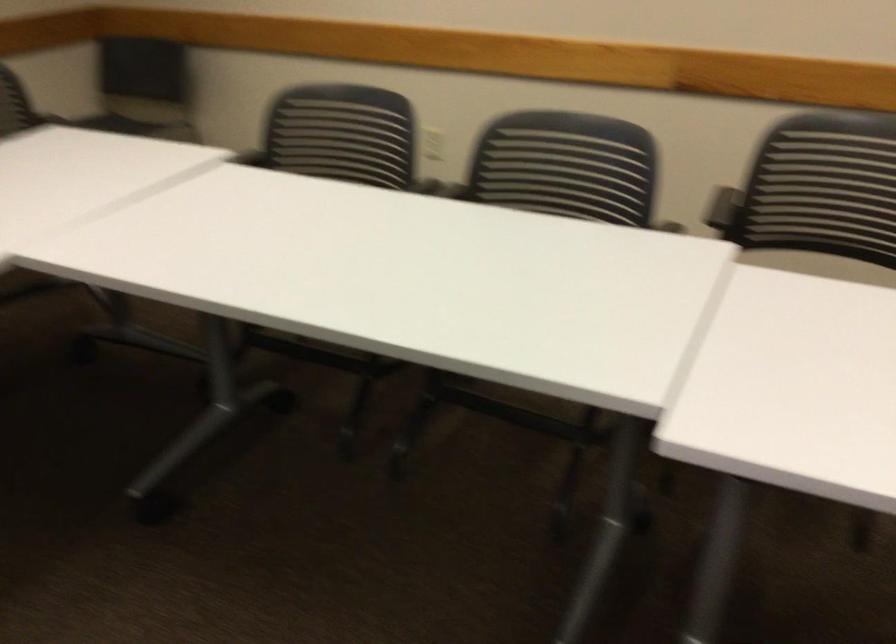
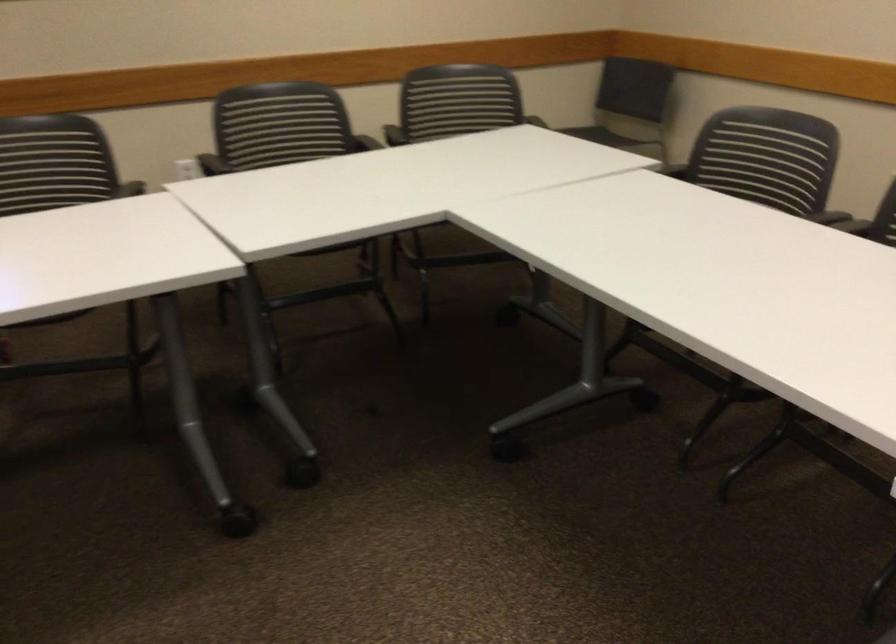
Find the pixel in the second image that matches point 212,140 in the first image.

(660, 158)